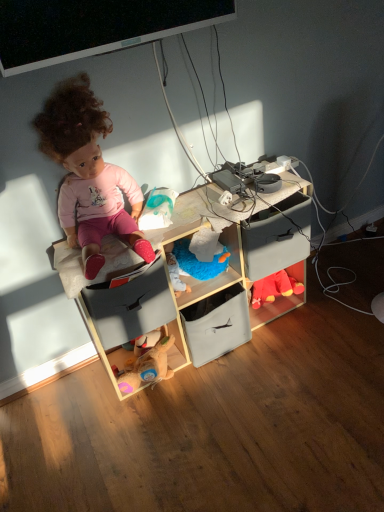
The width and height of the screenshot is (384, 512). What are the coordinates of `vacant space to the right of soft fabric storage at center, positioned as the second shelf in left-to-right order` in the screenshot? It's located at (279, 341).